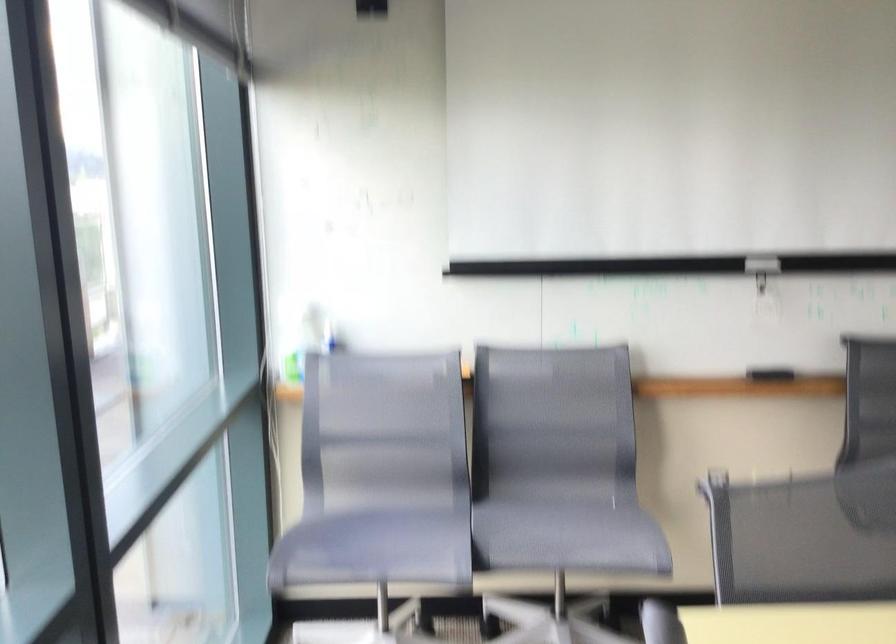
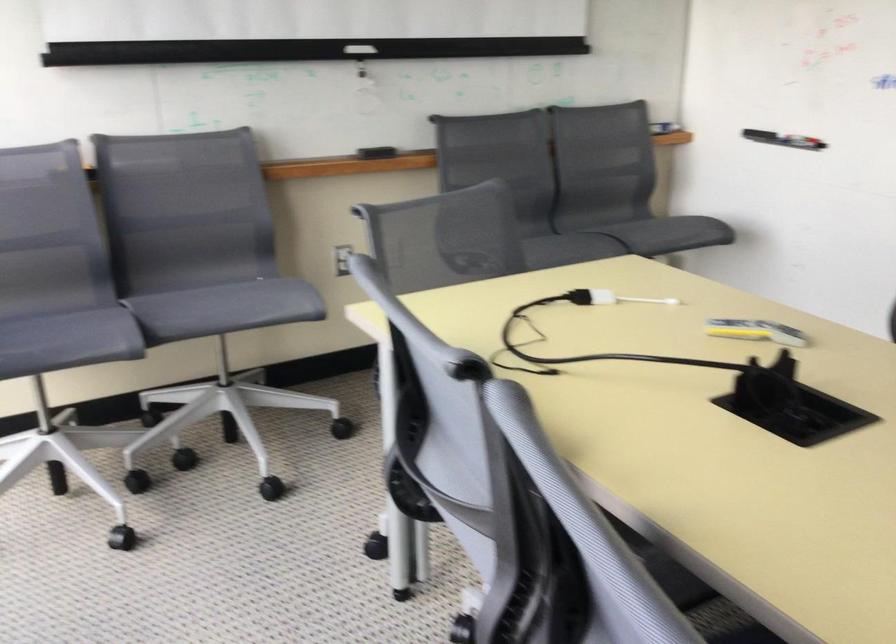
Where in the second image is the point corresponding to (x=558, y=544) from the first image?

(225, 308)